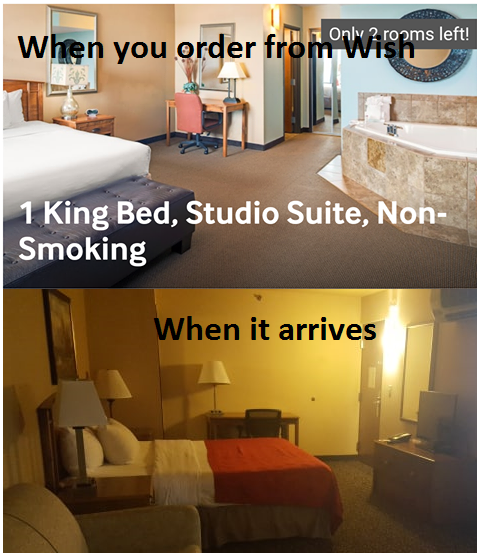
Identify the location of lamp. (72, 107), (231, 71).